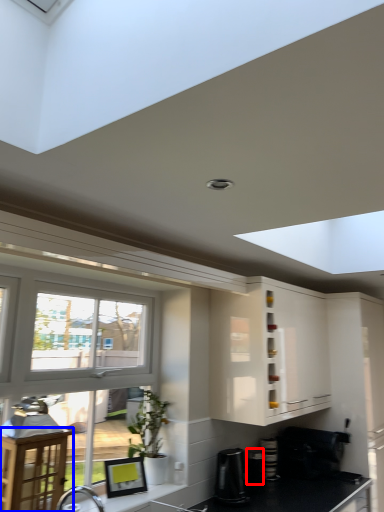
Question: Which of the following is the closest to the observer, appliance (highlighted by a red box) or table (highlighted by a blue box)?

Choices:
 (A) appliance
 (B) table

Answer: (B)